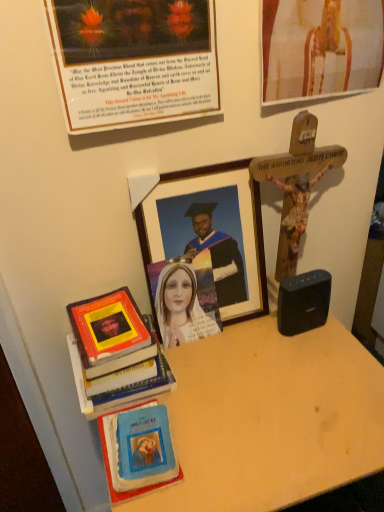
What do you see at coordinates (270, 418) in the screenshot? I see `wooden table at lower left` at bounding box center [270, 418].

I want to click on wooden table at lower left, so click(270, 418).

Describe the element at coordinates (134, 61) in the screenshot. The image size is (384, 512). I see `matte paper picture frame at upper left, which is the 2th picture frame in top-to-bottom order` at that location.

Where is `black plastic speaker at right`? black plastic speaker at right is located at coordinates (303, 302).

Identify the location of wooden picture frame at center, which is the 1th picture frame from bottom to top. (210, 232).

Image resolution: width=384 pixels, height=512 pixels. Find the location of `blue matte book at center, positioned as the second book in top-to-bottom order`. blue matte book at center, positioned as the second book in top-to-bottom order is located at coordinates (110, 464).

Does wooden table at lower left come in front of wooden picture frame at center, acting as the third picture frame starting from the top?

Yes, wooden table at lower left is closer to the viewer.

Is wooden table at lower left positioned beyond the bounds of wooden picture frame at center, which is the 1th picture frame from bottom to top?

Yes, wooden table at lower left is located beyond the bounds of wooden picture frame at center, which is the 1th picture frame from bottom to top.

Which of these two, wooden table at lower left or wooden picture frame at center, which is the 1th picture frame from bottom to top, stands taller?

wooden table at lower left is taller.

How far apart are matte paper portrait at center and matte paper picture frame at upper left, which is the 2th picture frame in bottom-to-top order?

matte paper portrait at center and matte paper picture frame at upper left, which is the 2th picture frame in bottom-to-top order, are 16.45 inches apart.

Is matte paper portrait at center completely or partially outside of matte paper picture frame at upper left, which is the 2th picture frame in top-to-bottom order?

Yes, matte paper portrait at center is not within matte paper picture frame at upper left, which is the 2th picture frame in top-to-bottom order.

In the scene shown: From a real-world perspective, is matte paper portrait at center positioned over matte paper picture frame at upper left, which is the 2th picture frame in bottom-to-top order, based on gravity?

Incorrect, from a real-world perspective, matte paper portrait at center is lower than matte paper picture frame at upper left, which is the 2th picture frame in bottom-to-top order.

Is matte paper portrait at center taller than matte paper picture frame at upper left, which is the 2th picture frame in top-to-bottom order?

No.

Would you say hardcover book at left, arranged as the first book when viewed from the top, is outside wooden crucifix at upper right, the third picture frame in the bottom-to-top sequence?

Absolutely, hardcover book at left, arranged as the first book when viewed from the top, is external to wooden crucifix at upper right, the third picture frame in the bottom-to-top sequence.

Which of these two, hardcover book at left, arranged as the first book when viewed from the top, or wooden crucifix at upper right, the third picture frame in the bottom-to-top sequence, stands taller?

Standing taller between the two is wooden crucifix at upper right, the third picture frame in the bottom-to-top sequence.

From a real-world perspective, is hardcover book at left, arranged as the first book when viewed from the top, positioned over wooden crucifix at upper right, the third picture frame in the bottom-to-top sequence, based on gravity?

No, from a real-world perspective, hardcover book at left, arranged as the first book when viewed from the top, is not above wooden crucifix at upper right, the third picture frame in the bottom-to-top sequence.

Which of these two, hardcover book at left, arranged as the first book when viewed from the top, or wooden crucifix at upper right, the third picture frame in the bottom-to-top sequence, is thinner?

wooden crucifix at upper right, the third picture frame in the bottom-to-top sequence.

How different are the orientations of wooden picture frame at center, which is the 1th picture frame from bottom to top, and wooden crucifix at upper right, the 1th picture frame positioned from the top, in degrees?

The angle between the facing direction of wooden picture frame at center, which is the 1th picture frame from bottom to top, and the facing direction of wooden crucifix at upper right, the 1th picture frame positioned from the top, is 1.78 degrees.

Where is `picture frame behind the wooden crucifix at upper right, the 1th picture frame positioned from the top`? Image resolution: width=384 pixels, height=512 pixels. picture frame behind the wooden crucifix at upper right, the 1th picture frame positioned from the top is located at coordinates (210, 232).

Is point (232, 238) positioned in front of point (379, 55)?

That is False.

Is wooden picture frame at center, which is the 1th picture frame from bottom to top, outside of wooden crucifix at upper right, the third picture frame in the bottom-to-top sequence?

Yes, wooden picture frame at center, which is the 1th picture frame from bottom to top, is outside of wooden crucifix at upper right, the third picture frame in the bottom-to-top sequence.

Is matte paper portrait at center not near wooden picture frame at center, acting as the third picture frame starting from the top?

No, matte paper portrait at center is not far away from wooden picture frame at center, acting as the third picture frame starting from the top.

Does point (168, 322) appear closer or farther from the camera than point (149, 227)?

Point (168, 322) is farther from the camera than point (149, 227).

In the scene shown: From the image's perspective, is matte paper portrait at center below wooden picture frame at center, which is the 1th picture frame from bottom to top?

Yes, from the image's perspective, matte paper portrait at center is beneath wooden picture frame at center, which is the 1th picture frame from bottom to top.

In the image, there is a matte paper picture frame at upper left, which is the 2th picture frame in bottom-to-top order. In order to click on speaker below it (from the image's perspective) in this screenshot , I will do `click(303, 302)`.

Considering the points (323, 272) and (184, 3), which point is in front, point (323, 272) or point (184, 3)?

Point (184, 3)

Based on their positions, is black plastic speaker at right located to the left or right of matte paper picture frame at upper left, which is the 2th picture frame in top-to-bottom order?

Clearly, black plastic speaker at right is on the right of matte paper picture frame at upper left, which is the 2th picture frame in top-to-bottom order, in the image.

Is black plastic speaker at right outside of matte paper picture frame at upper left, which is the 2th picture frame in top-to-bottom order?

Yes, black plastic speaker at right is outside of matte paper picture frame at upper left, which is the 2th picture frame in top-to-bottom order.

Considering the sizes of matte paper portrait at center and hardcover book at left, arranged as the first book when viewed from the top, in the image, is matte paper portrait at center taller or shorter than hardcover book at left, arranged as the first book when viewed from the top,?

Considering their sizes, matte paper portrait at center has more height than hardcover book at left, arranged as the first book when viewed from the top.

Can you tell me how much matte paper portrait at center and hardcover book at left, arranged as the first book when viewed from the top, differ in facing direction?

1.98 degrees.

Does matte paper portrait at center have a smaller size compared to hardcover book at left, which appears as the second book when ordered from the bottom?

Yes.

The width and height of the screenshot is (384, 512). What are the coordinates of `table in front of the wooden picture frame at center, acting as the third picture frame starting from the top` in the screenshot? It's located at (270, 418).

Identify the location of woman below the matte paper picture frame at upper left, which is the 2th picture frame in top-to-bottom order (from the image's perspective). Image resolution: width=384 pixels, height=512 pixels. (182, 307).

Looking at the image, which one is located further to matte paper portrait at center, blue matte book at center, positioned as the second book in top-to-bottom order, or hardcover book at left, arranged as the first book when viewed from the top?

blue matte book at center, positioned as the second book in top-to-bottom order, is positioned further to the anchor matte paper portrait at center.

Based on their spatial positions, is black plastic speaker at right or wooden table at lower left closer to matte paper picture frame at upper left, which is the 2th picture frame in top-to-bottom order?

black plastic speaker at right is closer to matte paper picture frame at upper left, which is the 2th picture frame in top-to-bottom order.

When comparing their distances from hardcover book at left, arranged as the first book when viewed from the top, does matte paper portrait at center or wooden table at lower left seem closer?

matte paper portrait at center is closer to hardcover book at left, arranged as the first book when viewed from the top.

From the picture: When comparing their distances from wooden crucifix at upper right, the third picture frame in the bottom-to-top sequence, does wooden picture frame at center, which is the 1th picture frame from bottom to top, or black plastic speaker at right seem closer?

Among the two, wooden picture frame at center, which is the 1th picture frame from bottom to top, is located nearer to wooden crucifix at upper right, the third picture frame in the bottom-to-top sequence.

Considering their positions, is wooden picture frame at center, which is the 1th picture frame from bottom to top, positioned closer to hardcover book at left, arranged as the first book when viewed from the top, than wooden crucifix at upper right, the 1th picture frame positioned from the top?

wooden picture frame at center, which is the 1th picture frame from bottom to top, is closer to hardcover book at left, arranged as the first book when viewed from the top.

From the image, which object appears to be nearer to matte paper picture frame at upper left, which is the 2th picture frame in top-to-bottom order, hardcover book at left, arranged as the first book when viewed from the top, or wooden crucifix at upper right, the third picture frame in the bottom-to-top sequence?

Among the two, wooden crucifix at upper right, the third picture frame in the bottom-to-top sequence, is located nearer to matte paper picture frame at upper left, which is the 2th picture frame in top-to-bottom order.

Looking at the image, which one is located closer to blue matte book at center, which is the 1th book in bottom-to-top order, wooden picture frame at center, which is the 1th picture frame from bottom to top, or matte paper picture frame at upper left, which is the 2th picture frame in bottom-to-top order?

wooden picture frame at center, which is the 1th picture frame from bottom to top, is closer to blue matte book at center, which is the 1th book in bottom-to-top order.

From the image, which object appears to be nearer to wooden picture frame at center, which is the 1th picture frame from bottom to top, wooden crucifix at upper right, the 1th picture frame positioned from the top, or matte paper portrait at center?

Among the two, matte paper portrait at center is located nearer to wooden picture frame at center, which is the 1th picture frame from bottom to top.

In order to click on woman that lies between matte paper picture frame at upper left, which is the 2th picture frame in top-to-bottom order, and blue matte book at center, which is the 1th book in bottom-to-top order, from top to bottom in this screenshot , I will do `click(182, 307)`.

Locate an element on the screen. speaker between matte paper picture frame at upper left, which is the 2th picture frame in bottom-to-top order, and hardcover book at left, arranged as the first book when viewed from the top, in the up-down direction is located at coordinates (303, 302).

Identify the location of woman between matte paper picture frame at upper left, which is the 2th picture frame in top-to-bottom order, and black plastic speaker at right from top to bottom. (182, 307).

Where is `picture frame between matte paper picture frame at upper left, which is the 2th picture frame in bottom-to-top order, and matte paper portrait at center, in the vertical direction`? This screenshot has width=384, height=512. picture frame between matte paper picture frame at upper left, which is the 2th picture frame in bottom-to-top order, and matte paper portrait at center, in the vertical direction is located at coordinates (x=210, y=232).